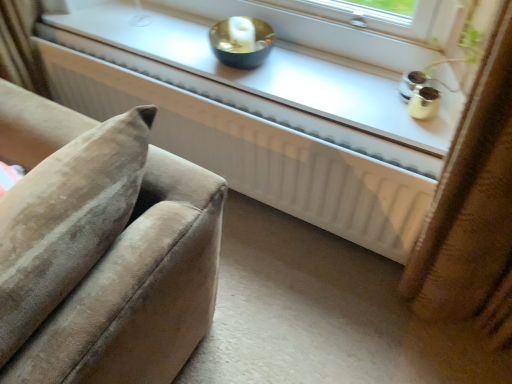
What do you see at coordinates (256, 154) in the screenshot? Image resolution: width=512 pixels, height=384 pixels. I see `white matte radiator at center` at bounding box center [256, 154].

This screenshot has width=512, height=384. What are the coordinates of `white matte radiator at center` in the screenshot? It's located at (256, 154).

In order to face white matte radiator at center, should I rotate leftwards or rightwards?

Turn left approximately 6.821 degrees to face it.

Image resolution: width=512 pixels, height=384 pixels. What do you see at coordinates (276, 68) in the screenshot?
I see `white glossy window sill at upper center` at bounding box center [276, 68].

Find the location of a particular element. white glossy window sill at upper center is located at coordinates (276, 68).

Locate an element on the screen. Image resolution: width=512 pixels, height=384 pixels. white matte radiator at center is located at coordinates (256, 154).

Considering the positions of objects white matte radiator at center and white glossy window sill at upper center in the image provided, who is more to the left, white matte radiator at center or white glossy window sill at upper center?

Positioned to the left is white matte radiator at center.

Considering their positions, is white matte radiator at center located in front of or behind white glossy window sill at upper center?

In the image, white matte radiator at center appears in front of white glossy window sill at upper center.

Which point is more forward, (268, 123) or (234, 73)?

The point (268, 123) is closer.

From the image's perspective, between white matte radiator at center and white glossy window sill at upper center, who is located below?

white matte radiator at center, from the image's perspective.

From a real-world perspective, which object stands above the other?

white glossy window sill at upper center, from a real-world perspective.

Considering the relative sizes of white matte radiator at center and white glossy window sill at upper center in the image provided, is white matte radiator at center thinner than white glossy window sill at upper center?

Yes.

Can you confirm if white matte radiator at center is taller than white glossy window sill at upper center?

Correct, white matte radiator at center is much taller as white glossy window sill at upper center.

Considering the sizes of objects white matte radiator at center and white glossy window sill at upper center in the image provided, who is bigger, white matte radiator at center or white glossy window sill at upper center?

With larger size is white matte radiator at center.

Can white glossy window sill at upper center be found inside white matte radiator at center?

Actually, white glossy window sill at upper center is outside white matte radiator at center.

Is the surface of white matte radiator at center in direct contact with white glossy window sill at upper center?

No.

Is white matte radiator at center looking in the opposite direction of white glossy window sill at upper center?

Absolutely, white matte radiator at center is directed away from white glossy window sill at upper center.

How different are the orientations of white matte radiator at center and white glossy window sill at upper center in degrees?

They differ by 0.15 degrees in their facing directions.

Consider the image. Measure the distance between white matte radiator at center and white glossy window sill at upper center.

A distance of 7.95 inches exists between white matte radiator at center and white glossy window sill at upper center.

Locate an element on the screen. window sill above the white matte radiator at center (from a real-world perspective) is located at coordinates (276, 68).

Is white glossy window sill at upper center to the left of white matte radiator at center from the viewer's perspective?

In fact, white glossy window sill at upper center is to the right of white matte radiator at center.

Considering their positions, is white glossy window sill at upper center located in front of or behind white matte radiator at center?

white glossy window sill at upper center is positioned farther from the viewer than white matte radiator at center.

Does point (55, 33) appear closer or farther from the camera than point (385, 180)?

Point (55, 33) is farther from the camera than point (385, 180).

From the image's perspective, is white glossy window sill at upper center below white matte radiator at center?

Actually, white glossy window sill at upper center appears above white matte radiator at center in the image.

From a real-world perspective, is white glossy window sill at upper center positioned above or below white matte radiator at center?

In terms of real-world spatial position, white glossy window sill at upper center is above white matte radiator at center.

Does white glossy window sill at upper center have a greater width compared to white matte radiator at center?

Indeed, white glossy window sill at upper center has a greater width compared to white matte radiator at center.

Based on the photo, considering the sizes of objects white glossy window sill at upper center and white matte radiator at center in the image provided, who is shorter, white glossy window sill at upper center or white matte radiator at center?

white glossy window sill at upper center.

Considering the relative sizes of white glossy window sill at upper center and white matte radiator at center in the image provided, is white glossy window sill at upper center bigger than white matte radiator at center?

Actually, white glossy window sill at upper center might be smaller than white matte radiator at center.

Is white glossy window sill at upper center outside of white matte radiator at center?

Indeed, white glossy window sill at upper center is completely outside white matte radiator at center.

Based on the photo, are white glossy window sill at upper center and white matte radiator at center located far from each other?

Result: white glossy window sill at upper center is actually quite close to white matte radiator at center.

From the picture: Does white glossy window sill at upper center turn towards white matte radiator at center?

Yes, white glossy window sill at upper center is aimed at white matte radiator at center.

Where is `radiator in front of the white glossy window sill at upper center`? The height and width of the screenshot is (384, 512). radiator in front of the white glossy window sill at upper center is located at coordinates (256, 154).

I want to click on window sill located above the white matte radiator at center (from the image's perspective), so click(276, 68).

At what (x,y) coordinates should I click in order to perform the action: click on radiator below the white glossy window sill at upper center (from a real-world perspective). Please return your answer as a coordinate pair (x, y). This screenshot has width=512, height=384. Looking at the image, I should click on (256, 154).